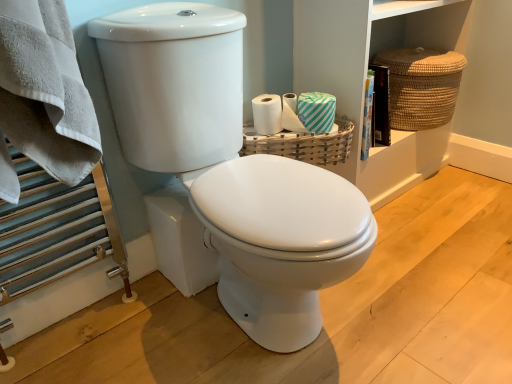
You are a GUI agent. You are given a task and a screenshot of the screen. Output one action in this format:
    pyautogui.click(x=<x>, y=<y>)
    Task: Click on the vacant region below white glossy toilet at center, positioned as the first toilet in front-to-back order (from a real-world perspective)
    
    Given the screenshot: What is the action you would take?
    pyautogui.click(x=259, y=336)